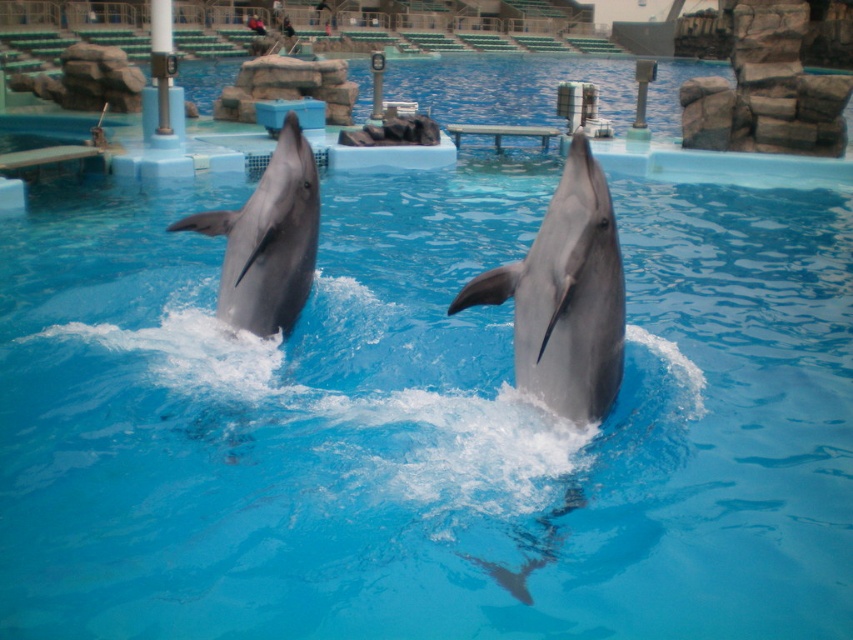
Question: Can you confirm if smooth gray dolphin at center is positioned to the left of glossy gray dolphin at center?

Choices:
 (A) yes
 (B) no

Answer: (B)

Question: Which of the following is the farthest from the observer?

Choices:
 (A) (595, 266)
 (B) (267, 301)

Answer: (B)

Question: From the image, what is the correct spatial relationship of smooth gray dolphin at center in relation to glossy gray dolphin at center?

Choices:
 (A) left
 (B) right

Answer: (B)

Question: Does smooth gray dolphin at center appear on the left side of glossy gray dolphin at center?

Choices:
 (A) no
 (B) yes

Answer: (A)